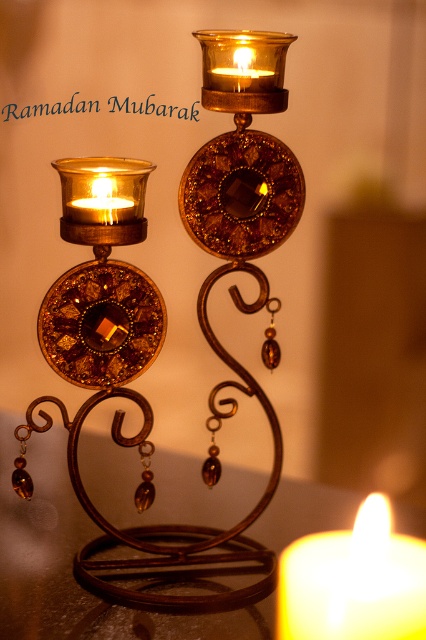
Question: Does translucent wax candle at center have a larger size compared to matte gold candle at upper center?

Choices:
 (A) no
 (B) yes

Answer: (B)

Question: Considering the relative positions of translucent wax candle at center and matte gold candle at left in the image provided, where is translucent wax candle at center located with respect to matte gold candle at left?

Choices:
 (A) right
 (B) left

Answer: (A)

Question: Is metallic brown table at center above translucent wax candle at center?

Choices:
 (A) no
 (B) yes

Answer: (B)

Question: Which point is closer to the camera taking this photo?

Choices:
 (A) (31, 595)
 (B) (268, 76)
 (C) (325, 540)

Answer: (B)

Question: Which object is farther from the camera taking this photo?

Choices:
 (A) metallic brown table at center
 (B) translucent wax candle at center

Answer: (A)

Question: Which of the following is the closest to the observer?

Choices:
 (A) gold metallic candle holder at center
 (B) translucent wax candle at center
 (C) metallic brown table at center
 (D) matte gold candle at left

Answer: (B)